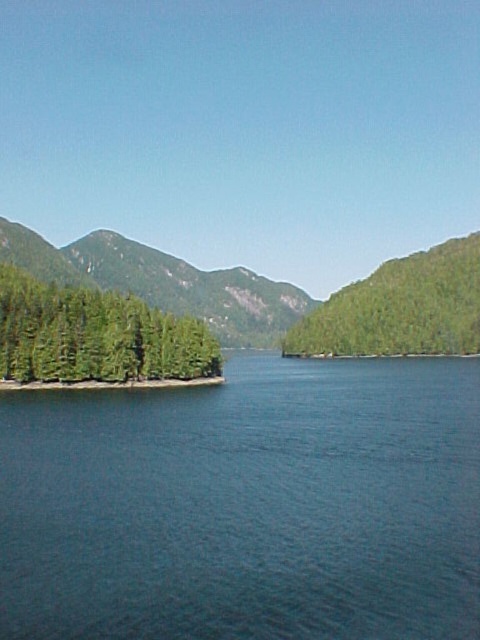
You are standing on the shore of the lake and want to throw a stone into the water. If you aim for the blue water at center and the green matte trees at left, which one will the stone reach first?

The blue water at center will be reached first because it is closer to the viewer than the green matte trees at left.

You are a hiker standing at the center of the image and want to know which object on the left side is wider. Which one has a greater width between the green matte trees at left and the green forested mountain at left?

The green forested mountain at left has a greater width than the green matte trees at left as the green matte trees at left is narrower than the green forested mountain at left.

You are standing at the point marked as point (247,506). What is the nearest object to you in the scene?

The nearest object to you at point (247,506) is the blue water at center, as you are standing directly at its location.